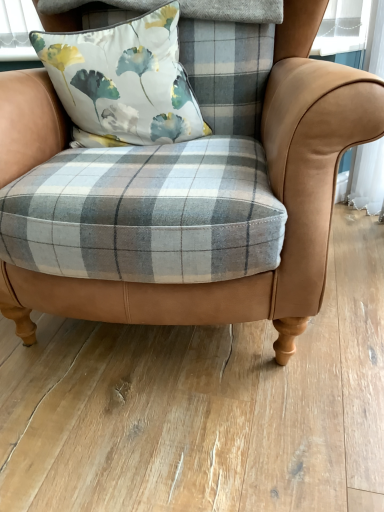
Locate an element on the screen. The width and height of the screenshot is (384, 512). matte plaid fabric chair at center is located at coordinates (273, 191).

The width and height of the screenshot is (384, 512). What do you see at coordinates (273, 191) in the screenshot?
I see `matte plaid fabric chair at center` at bounding box center [273, 191].

Measure the distance between matte plaid fabric chair at center and camera.

29.02 inches.

At what (x,y) coordinates should I click in order to perform the action: click on floral fabric cushion at upper center. Please return your answer as a coordinate pair (x, y). Looking at the image, I should click on tap(125, 79).

What do you see at coordinates (125, 79) in the screenshot? I see `floral fabric cushion at upper center` at bounding box center [125, 79].

Find the location of `matte plaid fabric chair at center`. matte plaid fabric chair at center is located at coordinates (273, 191).

Can you confirm if matte plaid fabric chair at center is positioned to the right of floral fabric cushion at upper center?

Correct, you'll find matte plaid fabric chair at center to the right of floral fabric cushion at upper center.

Relative to floral fabric cushion at upper center, is matte plaid fabric chair at center in front or behind?

matte plaid fabric chair at center is positioned closer to the viewer than floral fabric cushion at upper center.

Does point (297, 148) come in front of point (87, 58)?

Yes.

Based on the photo, from the image's perspective, is matte plaid fabric chair at center located above or below floral fabric cushion at upper center?

matte plaid fabric chair at center is below floral fabric cushion at upper center.

From the picture: From a real-world perspective, is matte plaid fabric chair at center positioned over floral fabric cushion at upper center based on gravity?

No, from a real-world perspective, matte plaid fabric chair at center is not above floral fabric cushion at upper center.

Between matte plaid fabric chair at center and floral fabric cushion at upper center, which one has smaller width?

With smaller width is floral fabric cushion at upper center.

Considering the sizes of objects matte plaid fabric chair at center and floral fabric cushion at upper center in the image provided, who is shorter, matte plaid fabric chair at center or floral fabric cushion at upper center?

Standing shorter between the two is floral fabric cushion at upper center.

Can you confirm if matte plaid fabric chair at center is bigger than floral fabric cushion at upper center?

Correct, matte plaid fabric chair at center is larger in size than floral fabric cushion at upper center.

Can floral fabric cushion at upper center be found inside matte plaid fabric chair at center?

Yes, matte plaid fabric chair at center is surrounding floral fabric cushion at upper center.

Is matte plaid fabric chair at center next to floral fabric cushion at upper center and touching it?

No, matte plaid fabric chair at center is not making contact with floral fabric cushion at upper center.

Is matte plaid fabric chair at center turned away from floral fabric cushion at upper center?

Yes, matte plaid fabric chair at center is facing away from floral fabric cushion at upper center.

How many degrees apart are the facing directions of matte plaid fabric chair at center and floral fabric cushion at upper center?

The angular difference between matte plaid fabric chair at center and floral fabric cushion at upper center is 18.6 degrees.

Locate an element on the screen. The image size is (384, 512). chair below the floral fabric cushion at upper center (from the image's perspective) is located at coordinates (273, 191).

Which object is positioned more to the left, floral fabric cushion at upper center or matte plaid fabric chair at center?

From the viewer's perspective, floral fabric cushion at upper center appears more on the left side.

Is the position of floral fabric cushion at upper center less distant than that of matte plaid fabric chair at center?

No, the depth of floral fabric cushion at upper center is greater than that of matte plaid fabric chair at center.

Considering the points (80, 100) and (316, 249), which point is in front, point (80, 100) or point (316, 249)?

Positioned in front is point (316, 249).

From the image's perspective, which one is positioned higher, floral fabric cushion at upper center or matte plaid fabric chair at center?

floral fabric cushion at upper center, from the image's perspective.

From a real-world perspective, is floral fabric cushion at upper center physically below matte plaid fabric chair at center?

No, from a real-world perspective, floral fabric cushion at upper center is not below matte plaid fabric chair at center.

Considering the relative sizes of floral fabric cushion at upper center and matte plaid fabric chair at center in the image provided, is floral fabric cushion at upper center thinner than matte plaid fabric chair at center?

Correct, the width of floral fabric cushion at upper center is less than that of matte plaid fabric chair at center.

Considering the relative sizes of floral fabric cushion at upper center and matte plaid fabric chair at center in the image provided, is floral fabric cushion at upper center shorter than matte plaid fabric chair at center?

Yes, floral fabric cushion at upper center is shorter than matte plaid fabric chair at center.

Does floral fabric cushion at upper center have a larger size compared to matte plaid fabric chair at center?

Actually, floral fabric cushion at upper center might be smaller than matte plaid fabric chair at center.

Is floral fabric cushion at upper center inside the boundaries of matte plaid fabric chair at center, or outside?

floral fabric cushion at upper center is enclosed within matte plaid fabric chair at center.

Are floral fabric cushion at upper center and matte plaid fabric chair at center making contact?

floral fabric cushion at upper center is not next to matte plaid fabric chair at center, and they're not touching.

Is floral fabric cushion at upper center aimed at matte plaid fabric chair at center?

Yes, floral fabric cushion at upper center faces towards matte plaid fabric chair at center.

How different are the orientations of floral fabric cushion at upper center and matte plaid fabric chair at center in degrees?

They differ by 18.6 degrees in their facing directions.

This screenshot has width=384, height=512. What are the coordinates of `pillow above the matte plaid fabric chair at center (from a real-world perspective)` in the screenshot? It's located at (125, 79).

You are a GUI agent. You are given a task and a screenshot of the screen. Output one action in this format:
    pyautogui.click(x=<x>, y=<y>)
    Task: Click on the pillow above the matte plaid fabric chair at center (from the image's perspective)
    The image size is (384, 512).
    Given the screenshot: What is the action you would take?
    pyautogui.click(x=125, y=79)

This screenshot has height=512, width=384. I want to click on pillow that is above the matte plaid fabric chair at center (from a real-world perspective), so click(x=125, y=79).